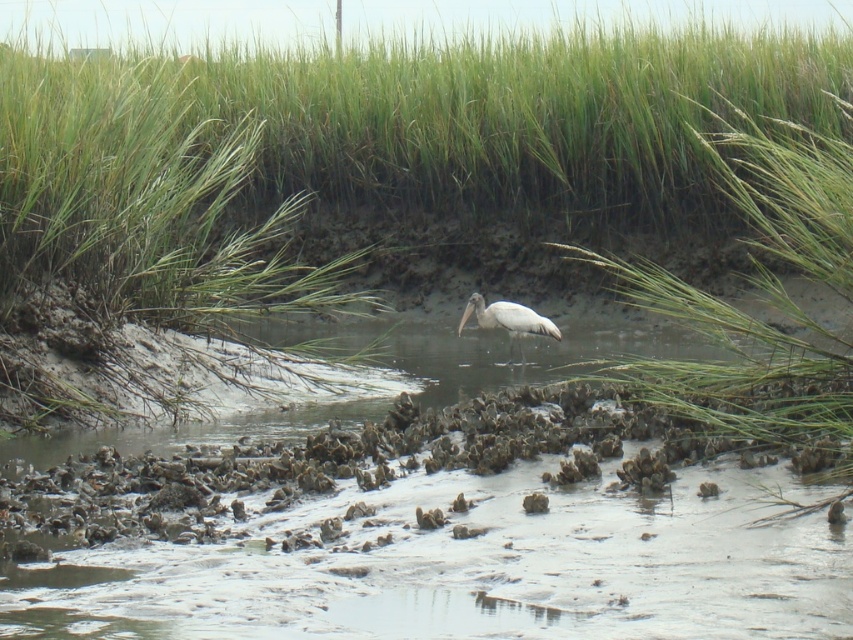
Question: Does green grass at center appear on the right side of white smooth stork at center?

Choices:
 (A) yes
 (B) no

Answer: (B)

Question: Which point is farther from the camera taking this photo?

Choices:
 (A) (479, 314)
 (B) (572, 44)

Answer: (B)

Question: Observing the image, what is the correct spatial positioning of green grass at center in reference to white smooth stork at center?

Choices:
 (A) above
 (B) below

Answer: (A)

Question: Does green grass at center have a lesser width compared to white smooth stork at center?

Choices:
 (A) yes
 (B) no

Answer: (B)

Question: Which point is closer to the camera?

Choices:
 (A) green grass at center
 (B) white smooth stork at center

Answer: (A)